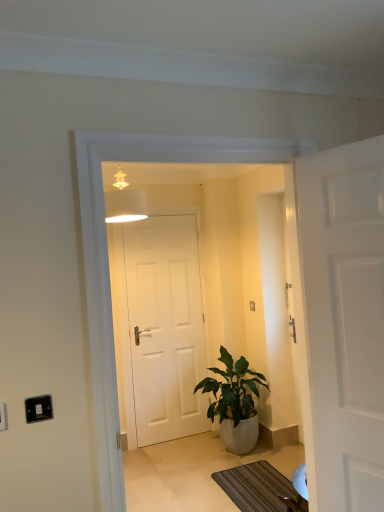
You are a GUI agent. You are given a task and a screenshot of the screen. Output one action in this format:
    pyautogui.click(x=<x>, y=<y>)
    Task: Click on the vacant point above striped fabric doormat at lower center (from a real-world perspective)
    
    Given the screenshot: What is the action you would take?
    pyautogui.click(x=258, y=483)